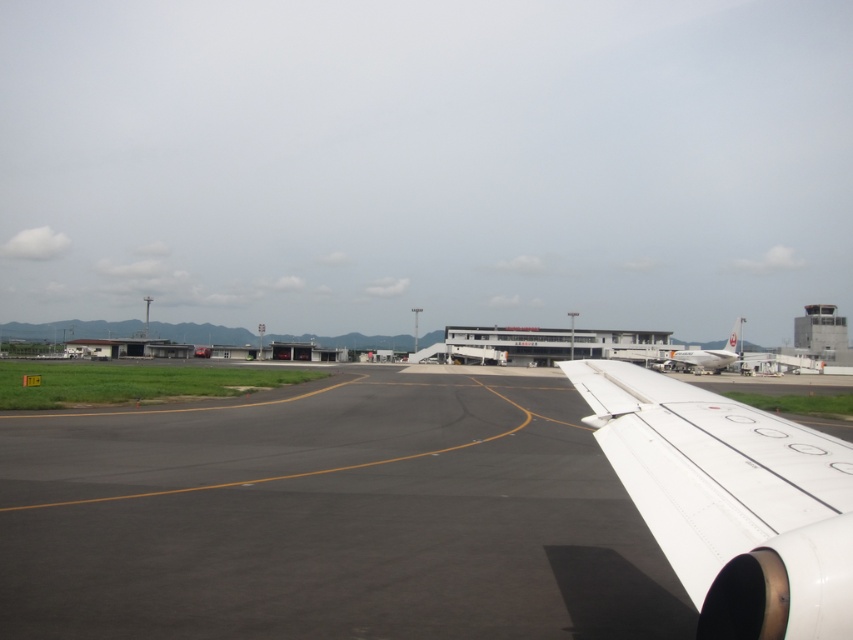
You are a flight attendant standing in the aircraft cabin near the window. You need to reach the emergency exit slide stored behind the white matte wing at right. Considering your height is 1.68 meters, will you be able to comfortably access the slide without stretching too much?

The white matte wing at right is 1.21 meters away from the viewer. Since your height is 1.68 meters, you can comfortably reach the emergency exit slide stored behind the white matte wing at right without needing to stretch excessively.

Looking at this image, you are a pilot preparing for takeoff and need to ensure the distance between the black asphalt tarmac at center and the white glossy airplane at right is safe. According to aviation regulations, the minimum safe distance required is 50 meters. Is the current distance sufficient?

The black asphalt tarmac at center is 57.26 meters away from the white glossy airplane at right, which exceeds the minimum required 50 meters, so the distance is sufficient.